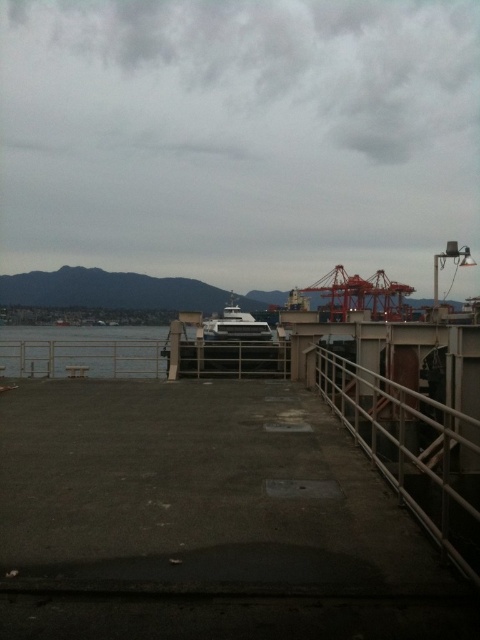
The image size is (480, 640). What do you see at coordinates (412, 451) in the screenshot?
I see `metal/rustic rail at right` at bounding box center [412, 451].

Find the location of a particular element. This screenshot has height=640, width=480. metal/rustic rail at right is located at coordinates (412, 451).

Does red metallic crane at center lie behind white glossy boat at center?

Yes, red metallic crane at center is further from the viewer.

Can you confirm if red metallic crane at center is positioned above white glossy boat at center?

Yes.

Which is behind, point (374, 273) or point (226, 320)?

Positioned behind is point (374, 273).

Where is `red metallic crane at center`? red metallic crane at center is located at coordinates (361, 294).

Is gray concrete dock at center to the right of clear water at left from the viewer's perspective?

Correct, you'll find gray concrete dock at center to the right of clear water at left.

Can you confirm if gray concrete dock at center is positioned below clear water at left?

Correct, gray concrete dock at center is located below clear water at left.

At what (x,y) coordinates should I click in order to perform the action: click on gray concrete dock at center. Please return your answer as a coordinate pair (x, y). The image size is (480, 640). Looking at the image, I should click on (204, 518).

Locate an element on the screen. gray concrete dock at center is located at coordinates (204, 518).